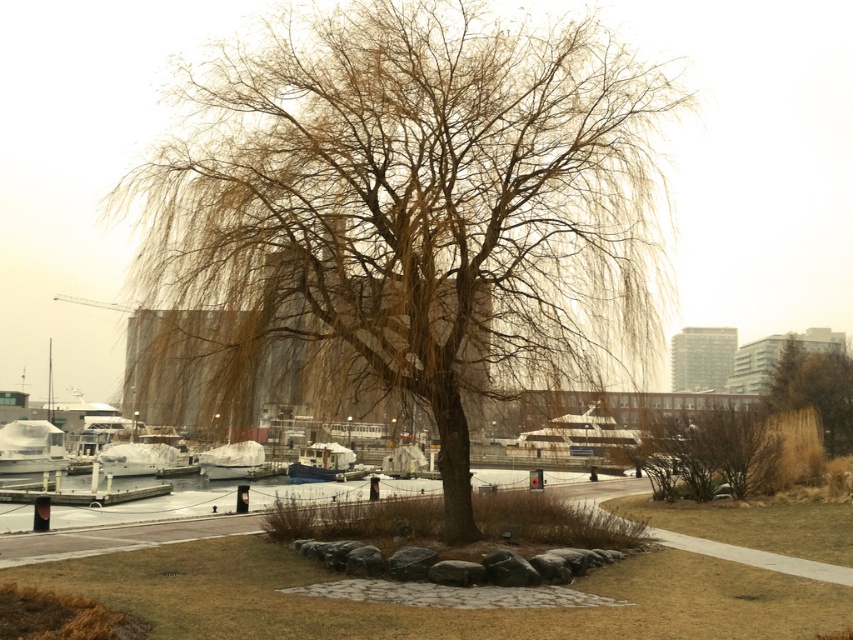
You are an urban planner assessing the space in the waterfront scene. You need to determine if the brown textured tree at center can be moved to make room for an additional boat similar in size to the white matte boat at lower left. Based on their sizes, is this feasible?

The brown textured tree at center occupies less space than the white matte boat at lower left. Therefore, removing the tree would allow space for an additional boat of the same size as the white matte boat at lower left.

You are a delivery drone that can travel up to 150 feet. You need to deliver a package from the brown textured tree at center to the white matte boat at lower left. Can you make the delivery without needing to recharge?

The distance between the brown textured tree at center and the white matte boat at lower left is 120.02 feet, which is within the drone delivery range of 150 feet. The drone can make the delivery without needing to recharge.